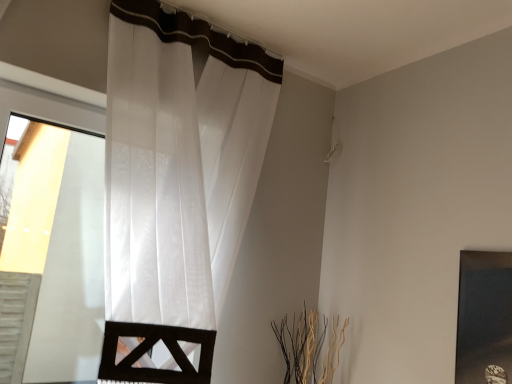
Question: Is matte black picture frame at right taller or shorter than white sheer curtain at left?

Choices:
 (A) short
 (B) tall

Answer: (A)

Question: Is matte black picture frame at right inside the boundaries of white sheer curtain at left, or outside?

Choices:
 (A) outside
 (B) inside

Answer: (A)

Question: Considering the relative positions of matte black picture frame at right and white sheer curtain at left in the image provided, is matte black picture frame at right to the left or to the right of white sheer curtain at left?

Choices:
 (A) left
 (B) right

Answer: (B)

Question: Choose the correct answer: Is white sheer curtain at left inside matte black picture frame at right or outside it?

Choices:
 (A) outside
 (B) inside

Answer: (A)

Question: From the image's perspective, is white sheer curtain at left positioned above or below matte black picture frame at right?

Choices:
 (A) below
 (B) above

Answer: (B)

Question: From their relative heights in the image, would you say white sheer curtain at left is taller or shorter than matte black picture frame at right?

Choices:
 (A) short
 (B) tall

Answer: (B)

Question: Considering the positions of white sheer curtain at left and matte black picture frame at right in the image, is white sheer curtain at left wider or thinner than matte black picture frame at right?

Choices:
 (A) wide
 (B) thin

Answer: (A)